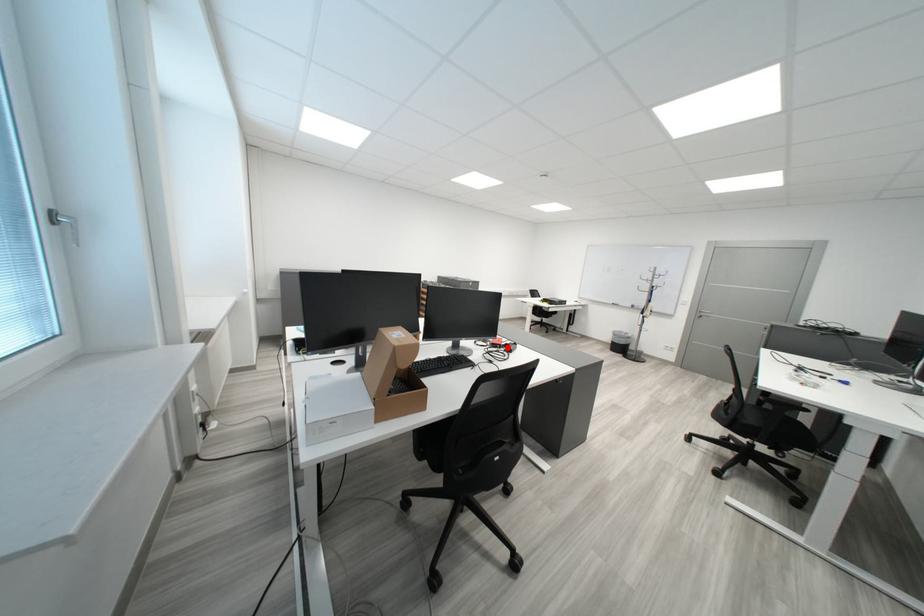
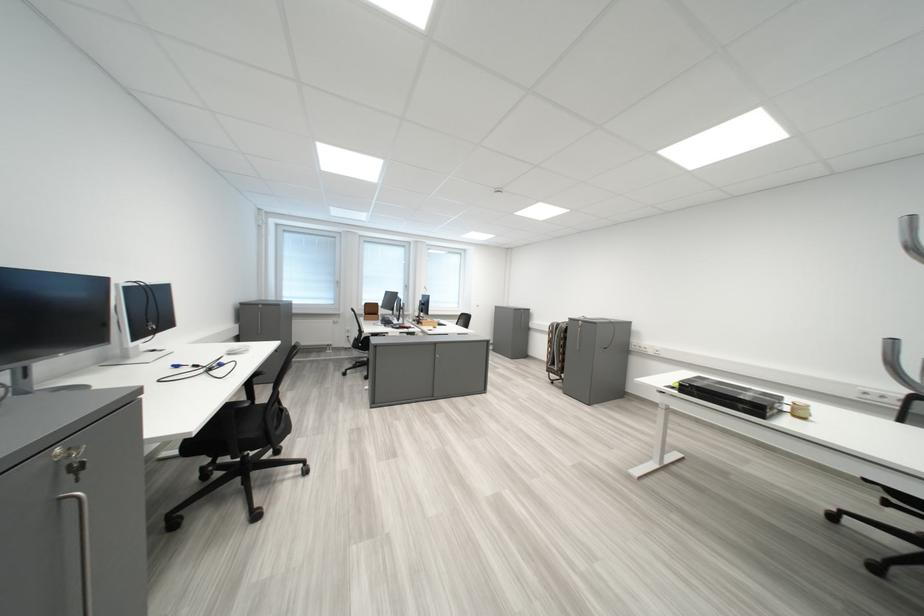
Question: I am providing you with two images of the same scene from different viewpoints. A red point is marked on the first image. Is the red point's position out of view in image 2?

Choices:
 (A) Yes
 (B) No

Answer: (A)